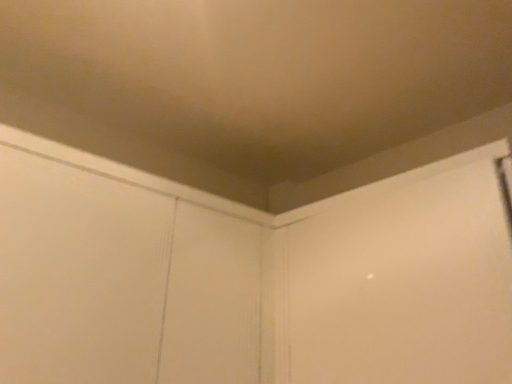
Question: Based on their sizes in the image, would you say white matte screen door at center, which is counted as the first screen door, starting from the right, is bigger or smaller than white wood screen door at upper center, arranged as the first screen door when viewed from the left?

Choices:
 (A) big
 (B) small

Answer: (B)

Question: From a real-world perspective, is white matte screen door at center, which is counted as the first screen door, starting from the right, above or below white wood screen door at upper center, placed as the second screen door when sorted from right to left?

Choices:
 (A) above
 (B) below

Answer: (A)

Question: Is white matte screen door at center, which is counted as the first screen door, starting from the right, to the left or to the right of white wood screen door at upper center, arranged as the first screen door when viewed from the left, in the image?

Choices:
 (A) right
 (B) left

Answer: (A)

Question: From the image's perspective, relative to white matte screen door at center, which is the second screen door from left to right, is white wood screen door at upper center, placed as the second screen door when sorted from right to left, above or below?

Choices:
 (A) above
 (B) below

Answer: (B)

Question: From a real-world perspective, is white wood screen door at upper center, arranged as the first screen door when viewed from the left, above or below white matte screen door at center, which is the second screen door from left to right?

Choices:
 (A) below
 (B) above

Answer: (A)

Question: Do you think white wood screen door at upper center, arranged as the first screen door when viewed from the left, is within white matte screen door at center, which is the second screen door from left to right, or outside of it?

Choices:
 (A) inside
 (B) outside

Answer: (B)

Question: From their relative heights in the image, would you say white wood screen door at upper center, arranged as the first screen door when viewed from the left, is taller or shorter than white matte screen door at center, which is counted as the first screen door, starting from the right?

Choices:
 (A) tall
 (B) short

Answer: (A)